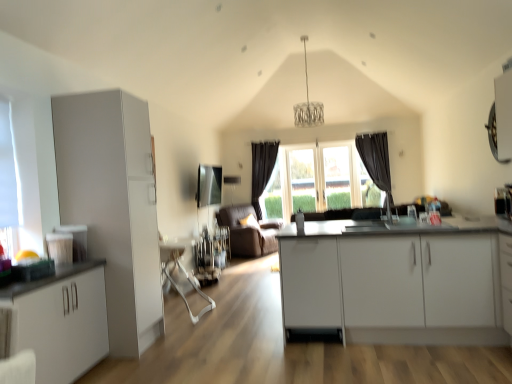
Describe the element at coordinates (248, 232) in the screenshot. I see `brown leather couch at center` at that location.

Locate an element on the screen. white plastic swivel chair at center is located at coordinates (181, 271).

What do you see at coordinates (8, 185) in the screenshot?
I see `transparent glass window at left, marked as the first window in a front-to-back arrangement` at bounding box center [8, 185].

Locate an element on the screen. white matte cabinet at left, the first cabinetry viewed from the left is located at coordinates (60, 320).

Locate an element on the screen. transparent glass door at center is located at coordinates (302, 180).

Is clear glass window at center, the 1th window viewed from the back, looking in the opposite direction of brown leather couch at center?

No, clear glass window at center, the 1th window viewed from the back, is not facing the opposite direction of brown leather couch at center.

From a real-world perspective, which is physically below, clear glass window at center, the 1th window viewed from the back, or brown leather couch at center?

brown leather couch at center.

Is clear glass window at center, the 1th window viewed from the right, thinner than brown leather couch at center?

Yes, clear glass window at center, the 1th window viewed from the right, is thinner than brown leather couch at center.

Is clear glass window at center, marked as the 3th window in a front-to-back arrangement, placed right next to brown leather couch at center?

No, clear glass window at center, marked as the 3th window in a front-to-back arrangement, is not touching brown leather couch at center.

Which is more to the right, white matte cabinet at left, which is the 3th cabinetry from right to left, or dark grey fabric curtain at right, the second curtain in the back-to-front sequence?

From the viewer's perspective, dark grey fabric curtain at right, the second curtain in the back-to-front sequence, appears more on the right side.

Is white matte cabinet at left, which is the 3th cabinetry from right to left, shorter than dark grey fabric curtain at right, the first curtain positioned from the front?

Yes.

Is dark grey fabric curtain at right, the first curtain positioned from the front, at the back of white matte cabinet at left, the first cabinetry viewed from the left?

No, white matte cabinet at left, the first cabinetry viewed from the left, is not facing the opposite direction of dark grey fabric curtain at right, the first curtain positioned from the front.

Where is `curtain that is the 1st object located behind the white matte cabinet at left, which is the 3th cabinetry from right to left`? curtain that is the 1st object located behind the white matte cabinet at left, which is the 3th cabinetry from right to left is located at coordinates (376, 161).

In the scene shown: In terms of size, does white matte cabinet at center, the first cabinetry in the right-to-left sequence, appear bigger or smaller than white matte cabinet at left, which is the 3th cabinetry from right to left?

In the image, white matte cabinet at center, the first cabinetry in the right-to-left sequence, appears to be larger than white matte cabinet at left, which is the 3th cabinetry from right to left.

Does white matte cabinet at center, the third cabinetry from the left, contain white matte cabinet at left, the first cabinetry viewed from the left?

No, white matte cabinet at left, the first cabinetry viewed from the left, is located outside of white matte cabinet at center, the third cabinetry from the left.

From the picture: Is white matte cabinet at left, which is the 3th cabinetry from right to left, at the back of white matte cabinet at center, the third cabinetry from the left?

No, white matte cabinet at center, the third cabinetry from the left, is not facing away from white matte cabinet at left, which is the 3th cabinetry from right to left.

Considering the points (335, 286) and (84, 367), which point is behind, point (335, 286) or point (84, 367)?

The point (335, 286) is farther from the camera.

Which of these two, white plastic swivel chair at center or transparent glass door at center, is thinner?

transparent glass door at center is thinner.

What's the angular difference between white plastic swivel chair at center and transparent glass door at center's facing directions?

white plastic swivel chair at center and transparent glass door at center are facing 90.2 degrees away from each other.

Is white plastic swivel chair at center smaller than transparent glass door at center?

No, white plastic swivel chair at center is not smaller than transparent glass door at center.

Considering the relative sizes of dark fabric curtain at center, acting as the 2th curtain starting from the right, and transparent glass window at left, which appears as the 1th window when viewed from the left, in the image provided, is dark fabric curtain at center, acting as the 2th curtain starting from the right, shorter than transparent glass window at left, which appears as the 1th window when viewed from the left,?

No.

Based on the photo, from the image's perspective, would you say dark fabric curtain at center, which is counted as the 1th curtain, starting from the back, is shown under transparent glass window at left, marked as the first window in a front-to-back arrangement?

No, from the image's perspective, dark fabric curtain at center, which is counted as the 1th curtain, starting from the back, is not beneath transparent glass window at left, marked as the first window in a front-to-back arrangement.

Is dark fabric curtain at center, the second curtain in the front-to-back sequence, not near transparent glass window at left, which ranks as the third window in right-to-left order?

Indeed, dark fabric curtain at center, the second curtain in the front-to-back sequence, is not near transparent glass window at left, which ranks as the third window in right-to-left order.

From a real-world perspective, which is physically below, dark fabric curtain at center, the second curtain in the front-to-back sequence, or transparent glass window at left, marked as the first window in a front-to-back arrangement?

From a 3D spatial view, dark fabric curtain at center, the second curtain in the front-to-back sequence, is below.

How much distance is there between white matte cabinet at left, marked as the 2th cabinetry in a left-to-right arrangement, and brown leather couch at center?

white matte cabinet at left, marked as the 2th cabinetry in a left-to-right arrangement, and brown leather couch at center are 3.50 meters apart from each other.

Is the position of white matte cabinet at left, marked as the 2th cabinetry in a left-to-right arrangement, less distant than that of brown leather couch at center?

That is True.

Is there a large distance between white matte cabinet at left, the second cabinetry in the right-to-left sequence, and brown leather couch at center?

Yes, white matte cabinet at left, the second cabinetry in the right-to-left sequence, is far from brown leather couch at center.

Is white matte cabinet at left, the second cabinetry in the right-to-left sequence, at the left side of brown leather couch at center?

Indeed, white matte cabinet at left, the second cabinetry in the right-to-left sequence, is positioned on the left side of brown leather couch at center.

Is dark grey fabric curtain at right, the first curtain positioned from the front, to the left or to the right of white plastic swivel chair at center in the image?

Clearly, dark grey fabric curtain at right, the first curtain positioned from the front, is on the right of white plastic swivel chair at center in the image.

Is dark grey fabric curtain at right, the second curtain in the back-to-front sequence, closer to camera compared to white plastic swivel chair at center?

No, dark grey fabric curtain at right, the second curtain in the back-to-front sequence, is further to the viewer.

Is dark grey fabric curtain at right, the first curtain positioned from the front, far away from white plastic swivel chair at center?

Indeed, dark grey fabric curtain at right, the first curtain positioned from the front, is not near white plastic swivel chair at center.

From the brown leather couch at center, count 2nd window to the right and point to it. Please provide its 2D coordinates.

[(337, 177)]

I want to click on the 1st curtain behind when counting from the white matte cabinet at left, the first cabinetry viewed from the left, so click(376, 161).

Considering their positions, is transparent glass window at left, which appears as the 1th window when viewed from the left, positioned closer to white matte cabinet at left, which is the 3th cabinetry from right to left, than dark grey fabric curtain at right, the first curtain positioned from the front?

Based on the image, transparent glass window at left, which appears as the 1th window when viewed from the left, appears to be nearer to white matte cabinet at left, which is the 3th cabinetry from right to left.

When comparing their distances from clear glass window at center, arranged as the third window when viewed from the left, does transparent glass door at center or transparent glass window at left, the 3th window from the back, seem closer?

transparent glass door at center is positioned closer to the anchor clear glass window at center, arranged as the third window when viewed from the left.

From the image, which object appears to be nearer to dark grey fabric curtain at right, the first curtain positioned from the front, white matte cabinet at left, marked as the 2th cabinetry in a left-to-right arrangement, or dark fabric curtain at center, acting as the 2th curtain starting from the right?

dark fabric curtain at center, acting as the 2th curtain starting from the right, is closer to dark grey fabric curtain at right, the first curtain positioned from the front.

Estimate the real-world distances between objects in this image. Which object is closer to transparent glass window at left, which ranks as the third window in right-to-left order, white matte cabinet at left, marked as the 2th cabinetry in a left-to-right arrangement, or brown leather couch at center?

white matte cabinet at left, marked as the 2th cabinetry in a left-to-right arrangement.

Considering their positions, is white plastic swivel chair at center positioned further to white matte cabinet at center, the first cabinetry in the right-to-left sequence, than transparent glass window at center, which is counted as the 2th window, starting from the left?

transparent glass window at center, which is counted as the 2th window, starting from the left, is further to white matte cabinet at center, the first cabinetry in the right-to-left sequence.

Considering their positions, is transparent glass door at center positioned closer to white matte cabinet at center, the third cabinetry from the left, than clear glass window at center, the 1th window viewed from the back?

Based on the image, clear glass window at center, the 1th window viewed from the back, appears to be nearer to white matte cabinet at center, the third cabinetry from the left.

From the image, which object appears to be nearer to white matte cabinet at center, the first cabinetry in the right-to-left sequence, transparent glass door at center or transparent glass window at center, which is counted as the 2th window, starting from the left?

transparent glass window at center, which is counted as the 2th window, starting from the left, lies closer to white matte cabinet at center, the first cabinetry in the right-to-left sequence, than the other object.

Based on the photo, from the image, which object appears to be farther from white matte cabinet at left, the first cabinetry viewed from the left, transparent glass window at left, which appears as the 1th window when viewed from the left, or transparent glass door at center?

The object further to white matte cabinet at left, the first cabinetry viewed from the left, is transparent glass door at center.

You are a GUI agent. You are given a task and a screenshot of the screen. Output one action in this format:
    pyautogui.click(x=<x>, y=<y>)
    Task: Click on the glass door located between brown leather couch at center and dark grey fabric curtain at right, the first curtain positioned from the front, in the left-right direction
    The image size is (512, 384).
    Given the screenshot: What is the action you would take?
    pyautogui.click(x=302, y=180)

Where is `couch located between white matte cabinet at center, the first cabinetry in the right-to-left sequence, and transparent glass window at center, which is the second window from right to left, in the depth direction`? The width and height of the screenshot is (512, 384). couch located between white matte cabinet at center, the first cabinetry in the right-to-left sequence, and transparent glass window at center, which is the second window from right to left, in the depth direction is located at coordinates (248, 232).

Where is `swivel chair between transparent glass window at left, which ranks as the third window in right-to-left order, and transparent glass door at center, along the z-axis`? The height and width of the screenshot is (384, 512). swivel chair between transparent glass window at left, which ranks as the third window in right-to-left order, and transparent glass door at center, along the z-axis is located at coordinates (181, 271).

This screenshot has width=512, height=384. What are the coordinates of `couch positioned between transparent glass window at left, which appears as the 1th window when viewed from the left, and dark fabric curtain at center, which is counted as the 1th curtain, starting from the left, from near to far` in the screenshot? It's located at (248, 232).